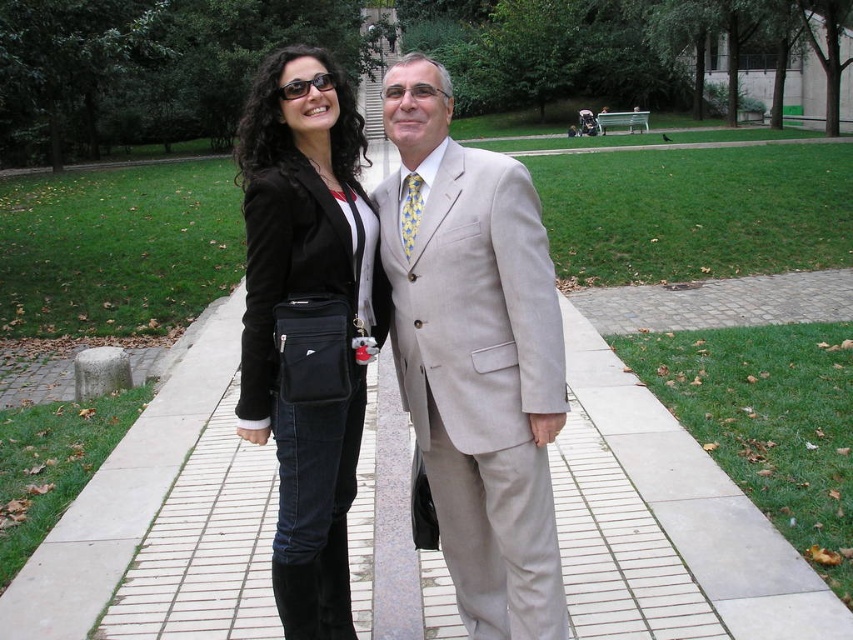
Question: Is light beige suit at center smaller than black leather jacket at center?

Choices:
 (A) yes
 (B) no

Answer: (A)

Question: Which point is closer to the camera?

Choices:
 (A) light beige suit at center
 (B) black leather jacket at center

Answer: (A)

Question: From the image, what is the correct spatial relationship of light beige suit at center in relation to black leather jacket at center?

Choices:
 (A) above
 (B) below

Answer: (B)

Question: Which of the following is the farthest from the observer?

Choices:
 (A) black leather jacket at center
 (B) light beige suit at center

Answer: (A)

Question: Does light beige suit at center appear over black leather jacket at center?

Choices:
 (A) no
 (B) yes

Answer: (A)